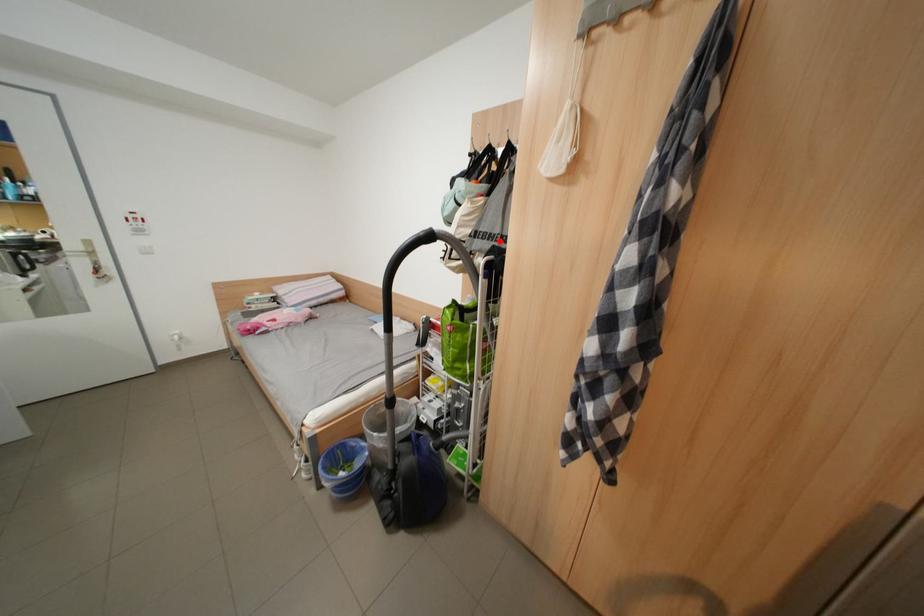
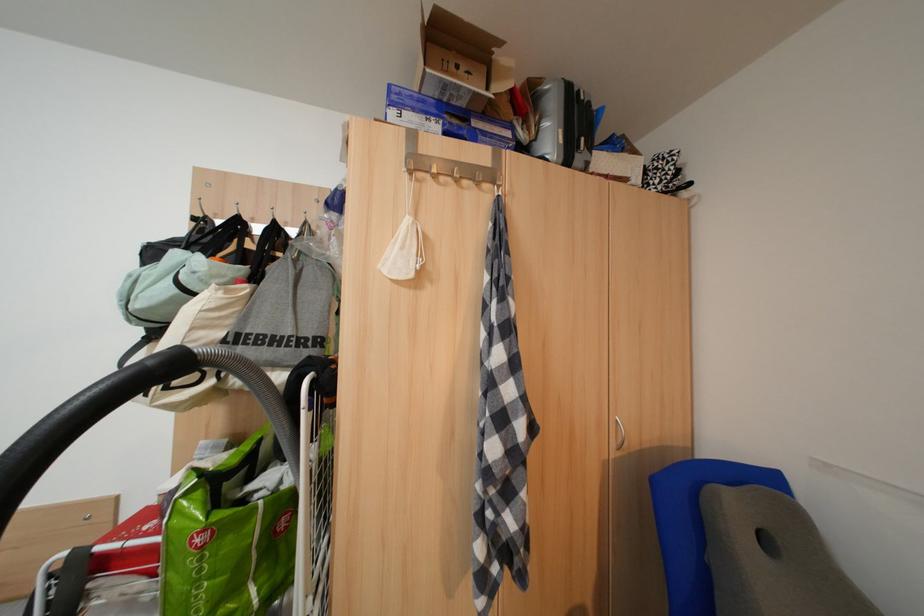
Locate, in the second image, the point that corresponds to the highlighted location in the first image.

(282, 346)